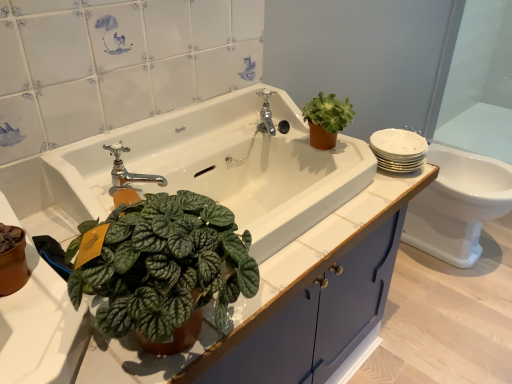
The height and width of the screenshot is (384, 512). Identify the location of vacant space in front of green matte succulent at upper right. coord(364,197).